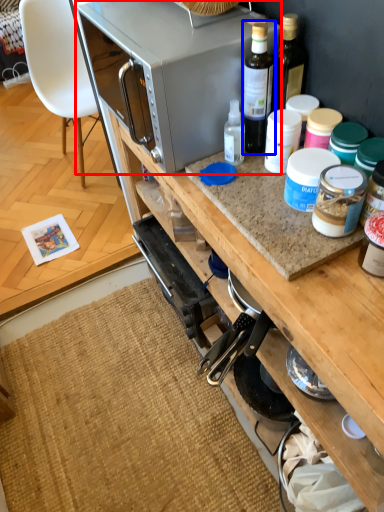
Question: Which object is closer to the camera taking this photo, microwave oven (highlighted by a red box) or bottle (highlighted by a blue box)?

Choices:
 (A) microwave oven
 (B) bottle

Answer: (B)